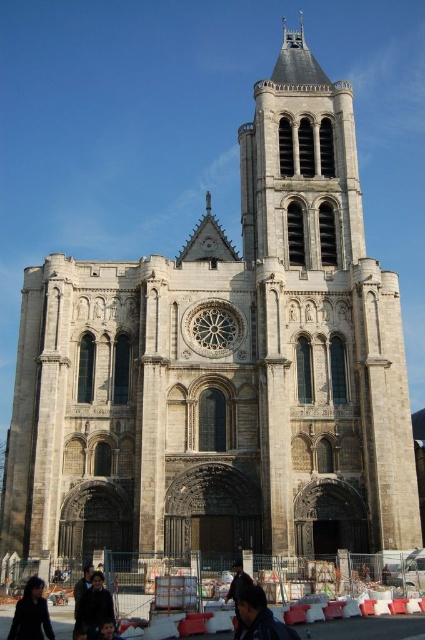
Question: Observing the image, what is the correct spatial positioning of dark brown leather jacket at center in reference to dark brown leather jacket at lower center?

Choices:
 (A) above
 (B) below

Answer: (B)

Question: Considering the relative positions of dark blue jacket at lower left and dark brown leather jacket at lower center in the image provided, where is dark blue jacket at lower left located with respect to dark brown leather jacket at lower center?

Choices:
 (A) below
 (B) above

Answer: (B)

Question: Which point is farther from the camera taking this photo?

Choices:
 (A) (87, 593)
 (B) (42, 636)
 (C) (240, 579)
 (D) (249, 596)

Answer: (C)

Question: Which object is the closest to the dark brown leather jacket at center?

Choices:
 (A) dark blue jacket at lower left
 (B) dark blue jacket at lower center
 (C) dark brown leather jacket at lower center
 (D) dark brown hair at lower left

Answer: (B)

Question: Which point is farther from the camera taking this photo?

Choices:
 (A) (243, 577)
 (B) (45, 624)

Answer: (A)

Question: Can you confirm if dark blue jacket at lower center is thinner than dark brown hair at lower left?

Choices:
 (A) yes
 (B) no

Answer: (A)